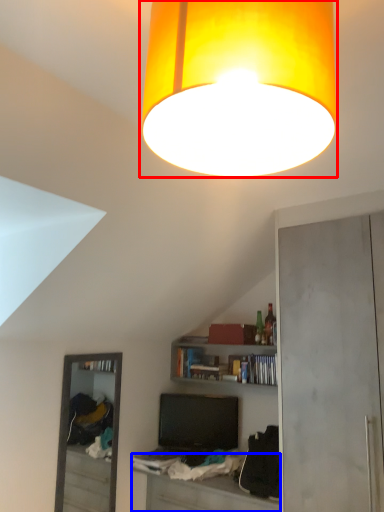
Question: Which point is closer to the camera, lamp (highlighted by a red box) or table (highlighted by a blue box)?

Choices:
 (A) lamp
 (B) table

Answer: (A)